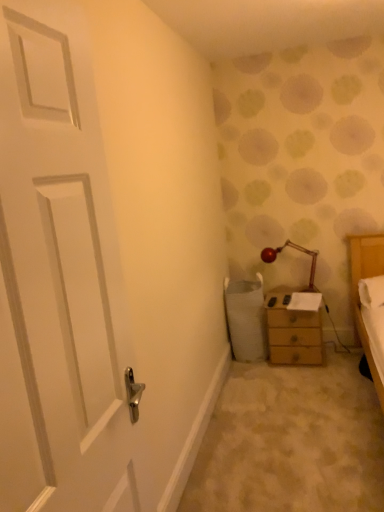
The width and height of the screenshot is (384, 512). Find the location of `matte red lamp at upper right`. matte red lamp at upper right is located at coordinates (298, 250).

Where is `white matte door at left`? This screenshot has height=512, width=384. white matte door at left is located at coordinates (59, 278).

Is matte red lamp at upper right positioned before white matte door at left?

No, the depth of matte red lamp at upper right is greater than that of white matte door at left.

Is point (304, 290) positioned before point (1, 62)?

That is False.

From the image's perspective, relative to white matte door at left, is matte red lamp at upper right above or below?

From the image's perspective, matte red lamp at upper right appears above white matte door at left.

Would you say matte red lamp at upper right is inside or outside white matte door at left?

matte red lamp at upper right is located beyond the bounds of white matte door at left.

From the image's perspective, which object appears higher, white matte door at left or wooden chest of drawers at right?

white matte door at left, from the image's perspective.

The image size is (384, 512). I want to click on the chest of drawers that is behind the white matte door at left, so click(295, 328).

How different are the orientations of white matte door at left and wooden chest of drawers at right in degrees?

They differ by 89.1 degrees in their facing directions.

Measure the distance from white matte door at left to wooden chest of drawers at right.

white matte door at left and wooden chest of drawers at right are 7.65 feet apart.

Could you tell me if wooden chest of drawers at right is turned towards white matte door at left?

Yes, wooden chest of drawers at right faces towards white matte door at left.

Considering the relative sizes of wooden chest of drawers at right and white matte door at left in the image provided, is wooden chest of drawers at right shorter than white matte door at left?

Yes, wooden chest of drawers at right is shorter than white matte door at left.

Which object is further away from the camera, wooden chest of drawers at right or white matte door at left?

wooden chest of drawers at right is behind.

You are a GUI agent. You are given a task and a screenshot of the screen. Output one action in this format:
    pyautogui.click(x=<x>, y=<y>)
    Task: Click on the lamp above the white matte door at left (from the image's perspective)
    This screenshot has height=512, width=384.
    Given the screenshot: What is the action you would take?
    pyautogui.click(x=298, y=250)

Which point is more forward, (2,337) or (273,255)?

The point (2,337) is closer to the camera.

Between white matte door at left and matte red lamp at upper right, which one is positioned in front?

white matte door at left is more forward.

Based on their sizes in the image, would you say matte red lamp at upper right is bigger or smaller than wooden chest of drawers at right?

Considering their sizes, matte red lamp at upper right takes up less space than wooden chest of drawers at right.

Does matte red lamp at upper right have a lesser height compared to wooden chest of drawers at right?

Yes, matte red lamp at upper right is shorter than wooden chest of drawers at right.

At what (x,y) coordinates should I click in order to perform the action: click on chest of drawers that is on the right side of matte red lamp at upper right. Please return your answer as a coordinate pair (x, y). Looking at the image, I should click on (295, 328).

Looking at their sizes, would you say matte red lamp at upper right is wider or thinner than wooden chest of drawers at right?

Considering their sizes, matte red lamp at upper right looks slimmer than wooden chest of drawers at right.

Considering the relative positions of wooden chest of drawers at right and matte red lamp at upper right in the image provided, is wooden chest of drawers at right to the left or to the right of matte red lamp at upper right?

wooden chest of drawers at right is to the right of matte red lamp at upper right.

Is wooden chest of drawers at right not within matte red lamp at upper right?

Absolutely, wooden chest of drawers at right is external to matte red lamp at upper right.

From a real-world perspective, who is located higher, wooden chest of drawers at right or matte red lamp at upper right?

matte red lamp at upper right is physically above.

From the picture: Does wooden chest of drawers at right have a lesser width compared to matte red lamp at upper right?

No.

What are the coordinates of `door above the matte red lamp at upper right (from a real-world perspective)` in the screenshot? It's located at (59, 278).

Identify the location of the chest of drawers that is under the white matte door at left (from a real-world perspective). This screenshot has width=384, height=512. (295, 328).

From the image, which object appears to be farther from wooden chest of drawers at right, matte red lamp at upper right or white matte door at left?

The object further to wooden chest of drawers at right is white matte door at left.

When comparing their distances from matte red lamp at upper right, does white matte door at left or wooden chest of drawers at right seem further?

The object further to matte red lamp at upper right is white matte door at left.

Based on their spatial positions, is wooden chest of drawers at right or matte red lamp at upper right closer to white matte door at left?

wooden chest of drawers at right is positioned closer to the anchor white matte door at left.

Looking at this image, based on their spatial positions, is white matte door at left or matte red lamp at upper right further from wooden chest of drawers at right?

The object further to wooden chest of drawers at right is white matte door at left.

Which object lies further to the anchor point matte red lamp at upper right, wooden chest of drawers at right or white matte door at left?

white matte door at left lies further to matte red lamp at upper right than the other object.

Based on their spatial positions, is matte red lamp at upper right or wooden chest of drawers at right further from white matte door at left?

Based on the image, matte red lamp at upper right appears to be further to white matte door at left.

The height and width of the screenshot is (512, 384). Find the location of `chest of drawers between white matte door at left and matte red lamp at upper right in the front-back direction`. chest of drawers between white matte door at left and matte red lamp at upper right in the front-back direction is located at coordinates [x=295, y=328].